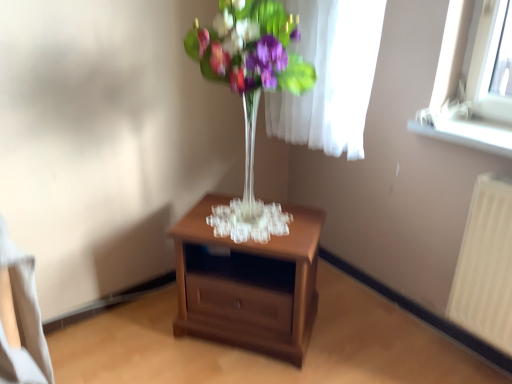
Question: Is white plastic radiator at right bigger or smaller than white plastic window sill at upper right?

Choices:
 (A) small
 (B) big

Answer: (B)

Question: Considering their positions, is white plastic radiator at right located in front of or behind white plastic window sill at upper right?

Choices:
 (A) behind
 (B) front

Answer: (B)

Question: Which of these objects is positioned farthest from the white plastic radiator at right?

Choices:
 (A) clear glass vase at center
 (B) white plastic window sill at upper right
 (C) brown wooden nightstand at center

Answer: (A)

Question: Which object is the closest to the brown wooden nightstand at center?

Choices:
 (A) white plastic window sill at upper right
 (B) white plastic radiator at right
 (C) clear glass vase at center

Answer: (C)